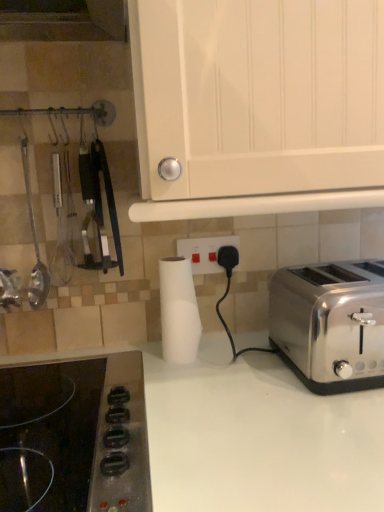
Question: Considering the relative positions of black glass cooktop at lower left and metallic silver ladle at left in the image provided, is black glass cooktop at lower left to the right of metallic silver ladle at left from the viewer's perspective?

Choices:
 (A) yes
 (B) no

Answer: (A)

Question: Is black glass cooktop at lower left positioned beyond the bounds of metallic silver ladle at left?

Choices:
 (A) no
 (B) yes

Answer: (B)

Question: From the image's perspective, would you say black glass cooktop at lower left is positioned over metallic silver ladle at left?

Choices:
 (A) no
 (B) yes

Answer: (A)

Question: From a real-world perspective, is black glass cooktop at lower left beneath metallic silver ladle at left?

Choices:
 (A) no
 (B) yes

Answer: (B)

Question: Can you confirm if black glass cooktop at lower left is smaller than metallic silver ladle at left?

Choices:
 (A) yes
 (B) no

Answer: (B)

Question: Is black glass cooktop at lower left further to the viewer compared to metallic silver ladle at left?

Choices:
 (A) yes
 (B) no

Answer: (B)

Question: Considering the relative positions of metallic silver ladle at left and black glass cooktop at lower left in the image provided, is metallic silver ladle at left to the left of black glass cooktop at lower left from the viewer's perspective?

Choices:
 (A) no
 (B) yes

Answer: (B)

Question: Is metallic silver ladle at left positioned in front of black glass cooktop at lower left?

Choices:
 (A) no
 (B) yes

Answer: (A)

Question: Does metallic silver ladle at left touch black glass cooktop at lower left?

Choices:
 (A) no
 (B) yes

Answer: (A)

Question: Is metallic silver ladle at left behind black glass cooktop at lower left?

Choices:
 (A) no
 (B) yes

Answer: (B)

Question: Is black glass cooktop at lower left completely or partially inside metallic silver ladle at left?

Choices:
 (A) no
 (B) yes

Answer: (A)

Question: Does metallic silver ladle at left have a lesser width compared to black glass cooktop at lower left?

Choices:
 (A) no
 (B) yes

Answer: (B)

Question: Is white matte paper towel at center at the left side of white glossy cabinet at upper center?

Choices:
 (A) yes
 (B) no

Answer: (A)